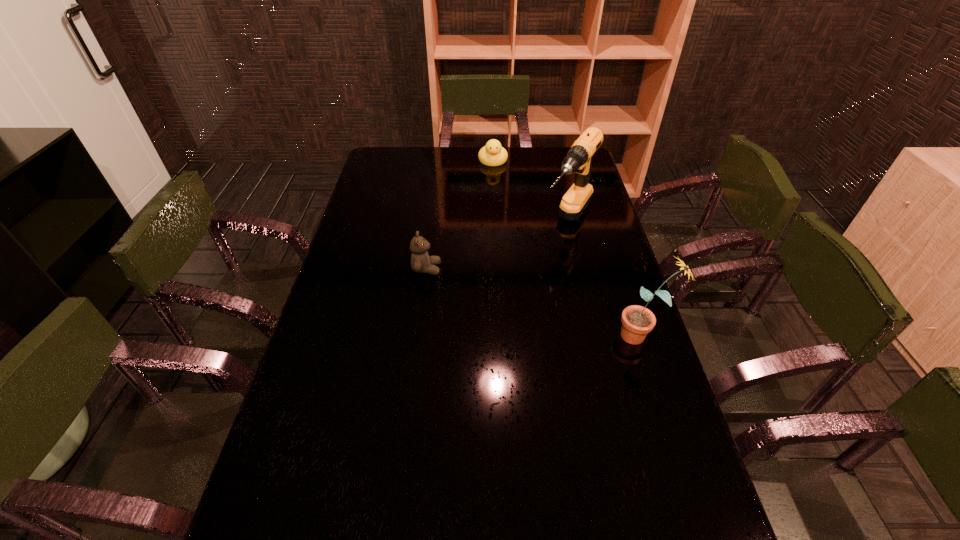
This screenshot has width=960, height=540. Find the location of `free region located at the tip of the drill`. free region located at the tip of the drill is located at coordinates (550, 261).

This screenshot has width=960, height=540. What are the coordinates of `free space located at the tip of the drill` in the screenshot? It's located at (538, 280).

Identify the location of vacant space located at the tip of the drill. (547, 265).

Where is `vacant space located on the face of the second object from left to right`? The width and height of the screenshot is (960, 540). vacant space located on the face of the second object from left to right is located at coordinates (494, 178).

This screenshot has width=960, height=540. What are the coordinates of `vacant space located on the face of the second object from left to right` in the screenshot? It's located at (497, 202).

Locate an element on the screen. This screenshot has height=540, width=960. vacant position located 0.390m on the face of the second object from left to right is located at coordinates (499, 225).

The width and height of the screenshot is (960, 540). I want to click on object located at the far edge, so click(493, 154).

This screenshot has width=960, height=540. I want to click on sunflower located in the right edge section of the desktop, so click(637, 321).

Identify the location of drill positioned at the right edge. (579, 158).

The height and width of the screenshot is (540, 960). I want to click on free space at the far edge of the desktop, so click(461, 168).